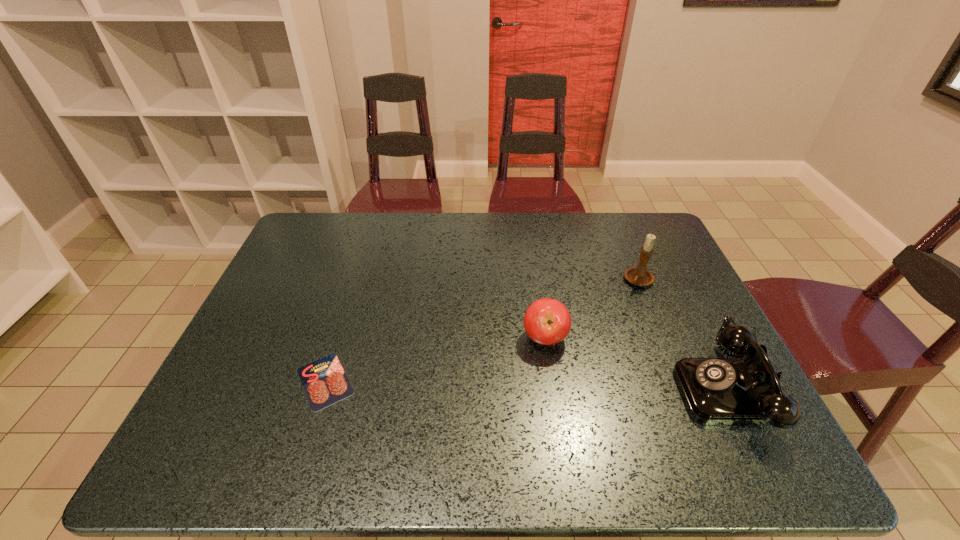
The height and width of the screenshot is (540, 960). In order to click on free space located on the side of the tallest object with the handle in this screenshot , I will do `click(600, 329)`.

The height and width of the screenshot is (540, 960). Identify the location of vacant point located on the side of the tallest object with the handle. (600, 329).

At what (x,y) coordinates should I click in order to perform the action: click on blank area located on the side of the tallest object with the handle. Please return your answer as a coordinate pair (x, y). Looking at the image, I should click on (588, 343).

This screenshot has width=960, height=540. In order to click on vacant point located 0.130m on the stem of the apple in this screenshot , I will do click(493, 380).

I want to click on vacant space located on the stem of the apple, so click(x=499, y=375).

Image resolution: width=960 pixels, height=540 pixels. What are the coordinates of `free space located 0.190m on the stem of the apple` in the screenshot? It's located at (474, 395).

Where is `salami located in the near edge section of the desktop`? This screenshot has height=540, width=960. salami located in the near edge section of the desktop is located at coordinates [324, 381].

The height and width of the screenshot is (540, 960). What are the coordinates of `telephone at the near edge` in the screenshot? It's located at (745, 390).

The image size is (960, 540). In order to click on telephone that is positioned at the right edge in this screenshot , I will do `click(745, 390)`.

This screenshot has height=540, width=960. In order to click on candle holder that is at the right edge in this screenshot , I will do `click(638, 275)`.